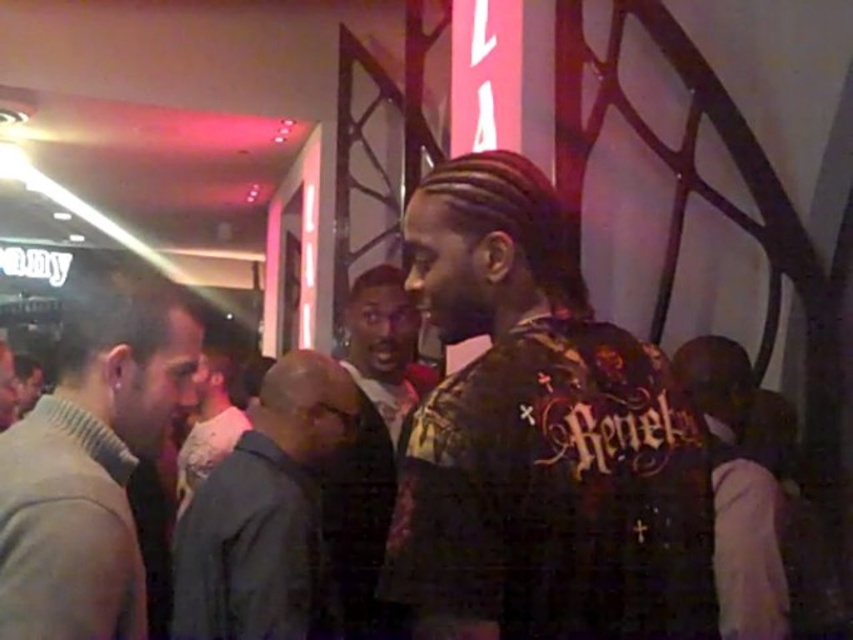
Can you confirm if printed fabric shirt at center is positioned below light brown sweater at left?

Actually, printed fabric shirt at center is above light brown sweater at left.

Which is below, printed fabric shirt at center or light brown sweater at left?

light brown sweater at left is below.

The image size is (853, 640). What do you see at coordinates (541, 438) in the screenshot?
I see `printed fabric shirt at center` at bounding box center [541, 438].

This screenshot has width=853, height=640. Find the location of `printed fabric shirt at center`. printed fabric shirt at center is located at coordinates (541, 438).

Describe the element at coordinates (91, 460) in the screenshot. This screenshot has width=853, height=640. I see `light brown sweater at left` at that location.

Measure the distance between light brown sweater at left and camera.

light brown sweater at left is 82.49 centimeters from camera.

I want to click on light brown sweater at left, so click(91, 460).

Who is higher up, dark gray jacket at center or dark brown leather jacket at center?

dark gray jacket at center

Where is `dark gray jacket at center`? This screenshot has height=640, width=853. dark gray jacket at center is located at coordinates (265, 513).

Locate an element on the screen. dark gray jacket at center is located at coordinates (265, 513).